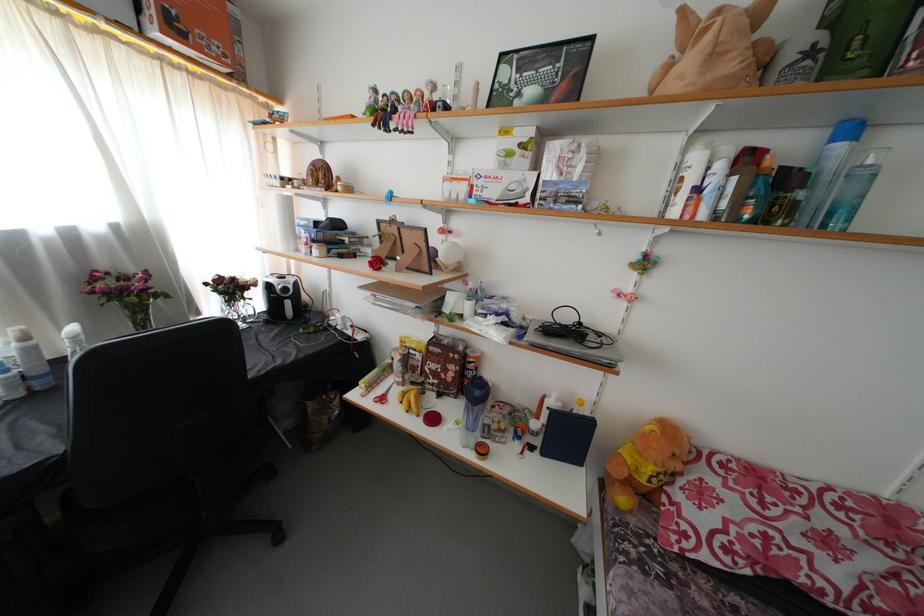
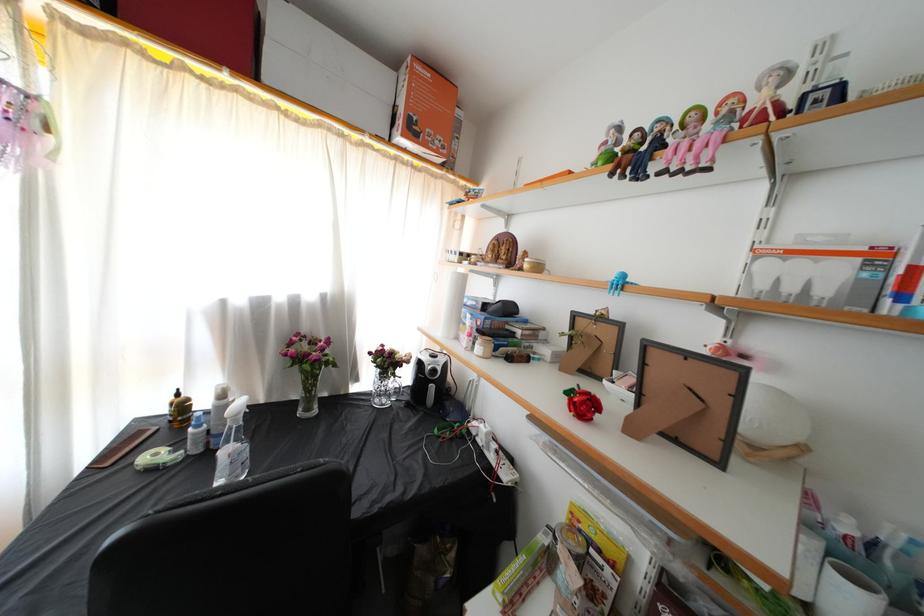
Where in the second image is the point corresponding to (x=180, y=34) from the first image?

(418, 137)